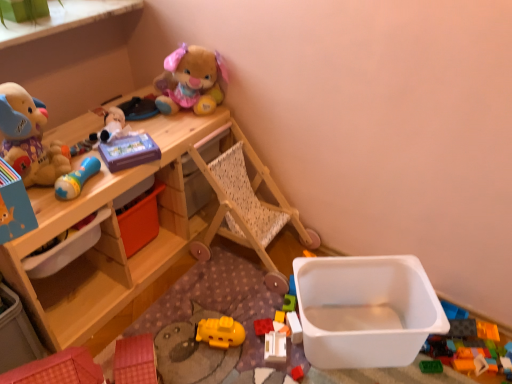
Locate an element on the screen. Image resolution: width=512 pixels, height=384 pixels. vacant area that lies to the right of white plastic toy at center, the 1th toy from the bottom is located at coordinates (312, 363).